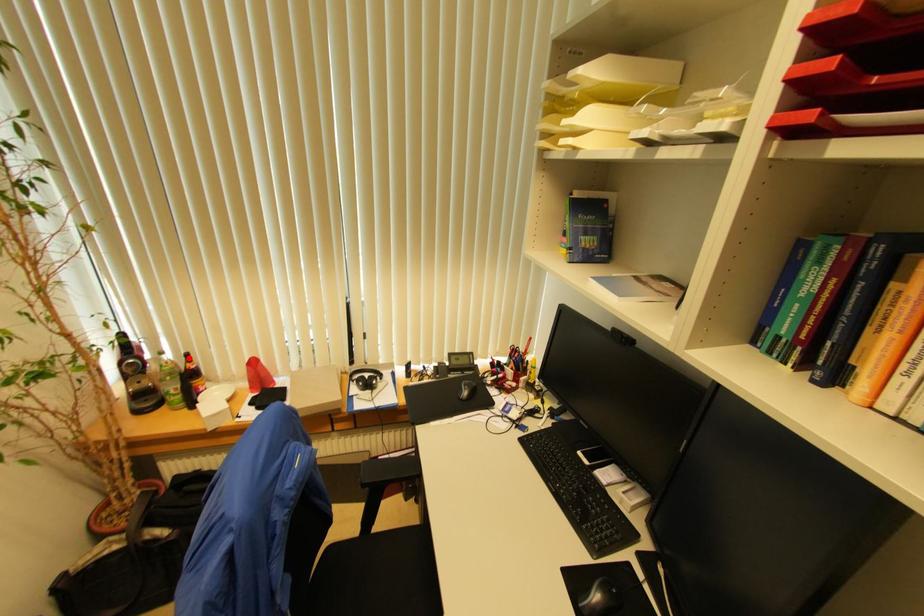
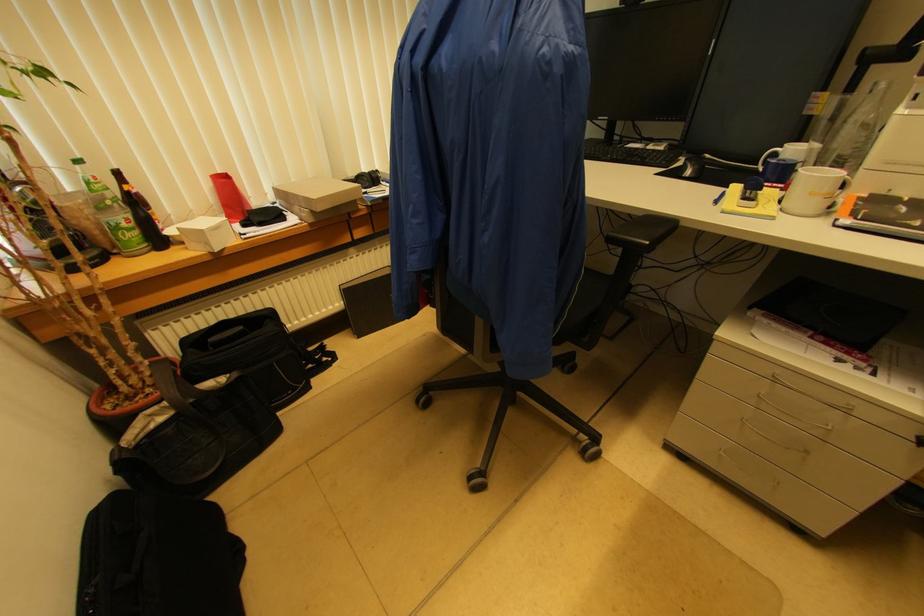
Question: A red point is marked in image1. In image2, is the corresponding 3D point closer to the camera or farther? Reply with the corresponding letter.

Choices:
 (A) The corresponding 3D point is closer.
 (B) The corresponding 3D point is farther.

Answer: (B)